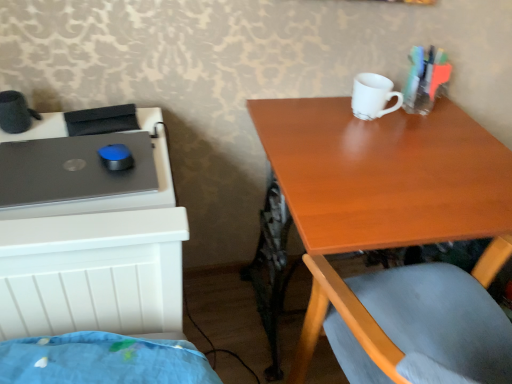
In order to click on blank space situated above wooden table at upper right (from a real-world perspective) in this screenshot , I will do `click(403, 155)`.